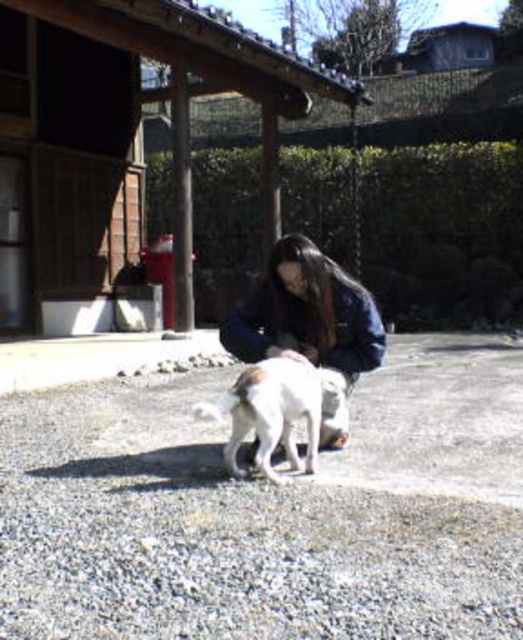
You are a photographer trying to capture the perfect shot of the white fur dog at center and the gray gravel at center. From which side of the dog should you position yourself to ensure the gravel is visible in the background?

To ensure the gray gravel at center is visible in the background, you should position yourself on the right side of the white fur dog at center since the gravel is on the dog s left side.

Consider the image. You are a photographer trying to capture the perfect shot of the scene. You notice a point at coordinates (x=306, y=314). What object is located at that point?

The point at coordinates (x=306, y=314) corresponds to the dark blue denim jacket at center.

You are standing at the edge of the scene and want to walk towards the dark blue denim jacket at center without stepping on the gray gravel at center. Which direction should you move first?

The gray gravel at center is positioned on the left side of the dark blue denim jacket at center. To avoid stepping on the gray gravel at center, you should move to the right side of the dark blue denim jacket at center first.